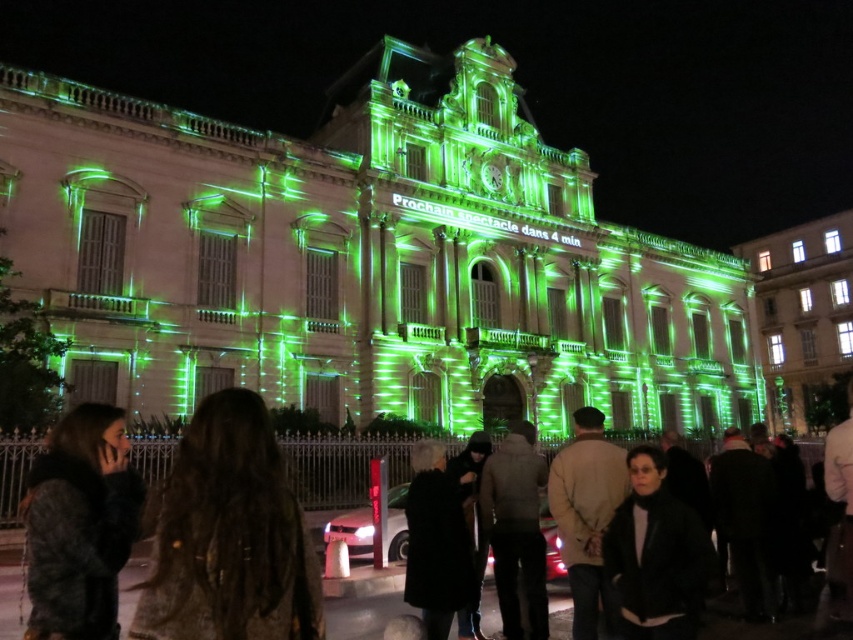
Question: Among these objects, which one is farthest from the camera?

Choices:
 (A) dark brown leather jacket at lower left
 (B) black leather jacket at center

Answer: (B)

Question: Which object is the closest to the black leather jacket at center?

Choices:
 (A) dark brown leather jacket at lower left
 (B) dark brown fur coat at lower left

Answer: (A)

Question: Can you confirm if dark brown leather jacket at lower left is smaller than dark brown fur coat at lower left?

Choices:
 (A) no
 (B) yes

Answer: (A)

Question: Can you confirm if dark brown leather jacket at lower left is smaller than dark brown fur coat at lower left?

Choices:
 (A) no
 (B) yes

Answer: (A)

Question: In this image, where is dark brown fur coat at lower left located relative to black leather jacket at center?

Choices:
 (A) left
 (B) right

Answer: (A)

Question: Which point is closer to the camera?

Choices:
 (A) dark brown fur coat at lower left
 (B) dark brown leather jacket at lower left

Answer: (B)